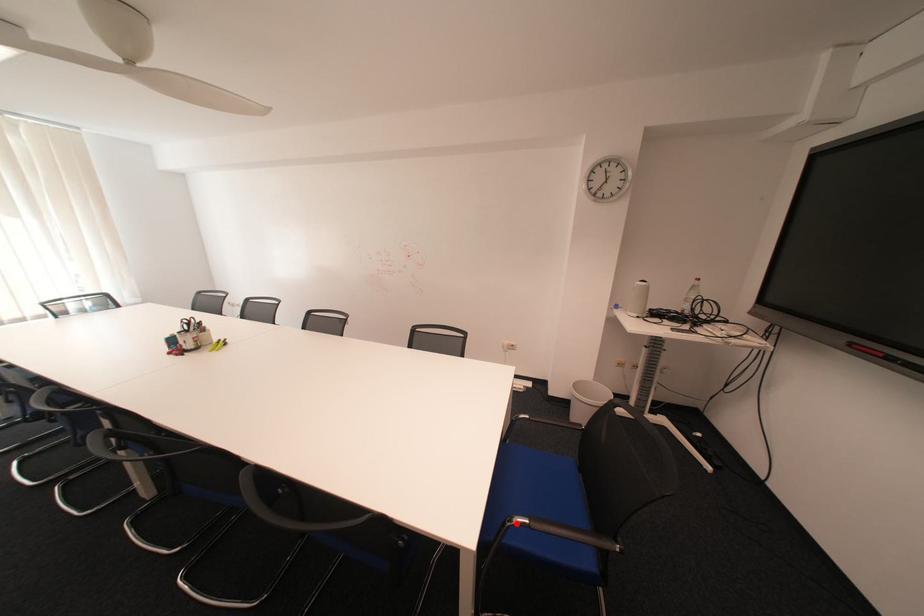
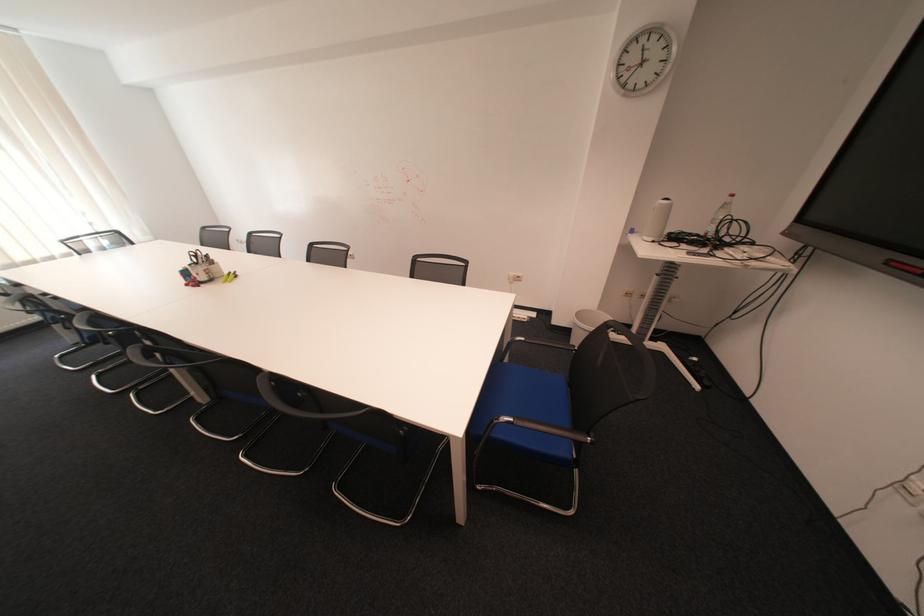
Find the pixel in the second image that matches the highlighted location in the first image.

(504, 422)